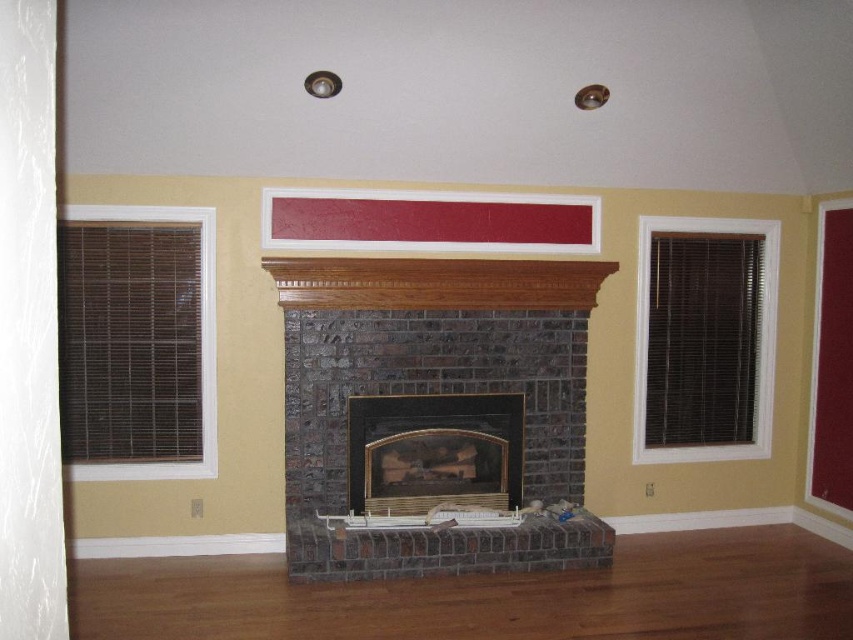
Who is more distant from viewer, (286, 332) or (405, 438)?

Point (405, 438)

In the scene shown: Who is more distant from viewer, (598, 284) or (421, 426)?

Point (598, 284)

Find the location of `dark gray brick fireplace at center`. dark gray brick fireplace at center is located at coordinates (433, 400).